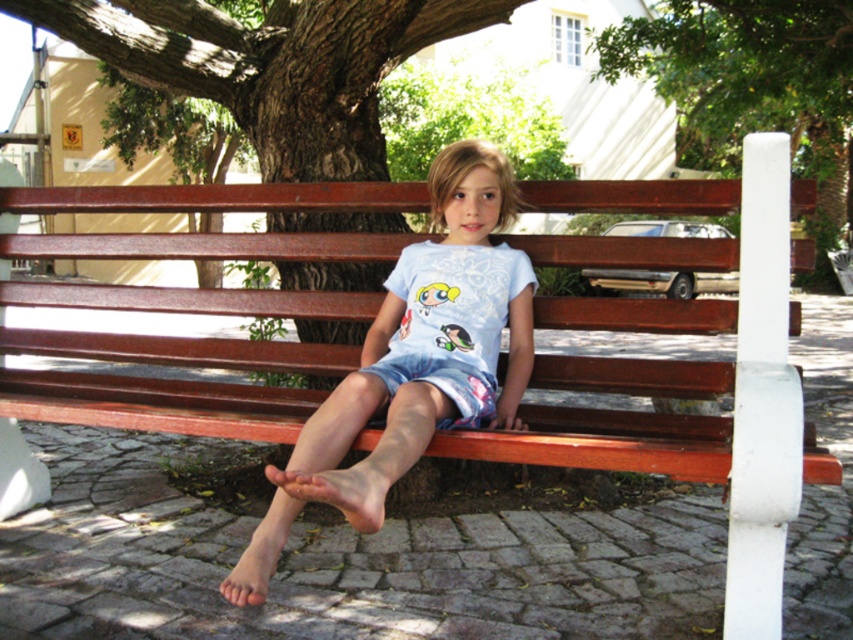
You are a photographer trying to capture the light blue cotton shirt at center and the green leafy tree at upper center in a single frame. Which object will appear smaller in the photo?

The light blue cotton shirt at center will appear smaller in the photo because it has a lesser height compared to the green leafy tree at upper center.

Based on the scene described, which object is smaller in size between the light blue cotton shirt at center and the green leafy tree at upper center?

The light blue cotton shirt at center is smaller in size compared to the green leafy tree at upper center.